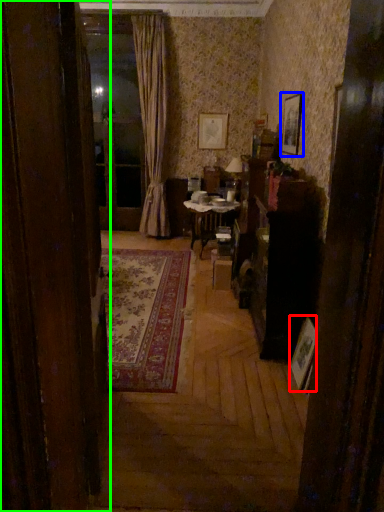
Question: Considering the real-world distances, which object is closest to picture frame (highlighted by a red box)? picture frame (highlighted by a blue box) or door (highlighted by a green box).

Choices:
 (A) picture frame
 (B) door

Answer: (B)